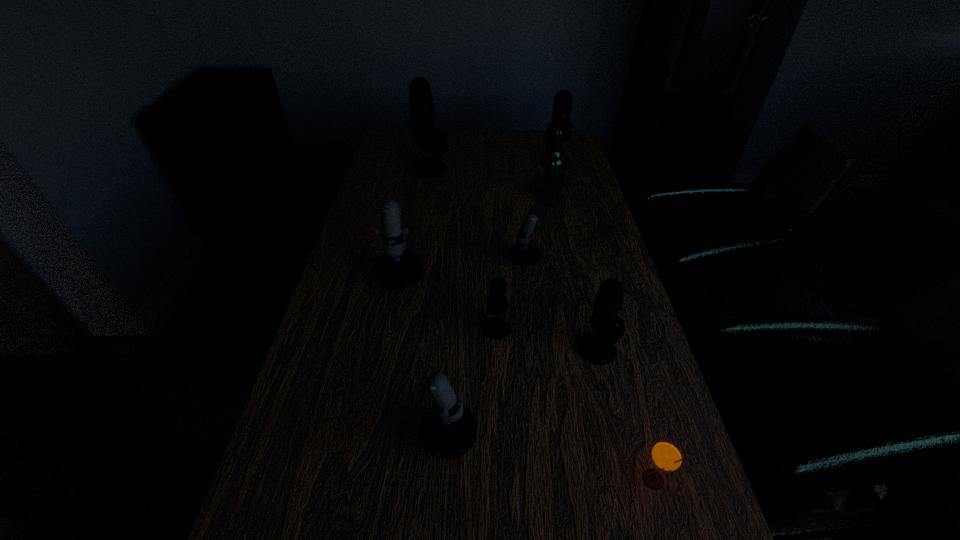
Locate an element on the screen. The width and height of the screenshot is (960, 540). free space located on the front of the second black microphone from left to right is located at coordinates (498, 385).

This screenshot has width=960, height=540. What are the coordinates of `free spot located on the back of the straw` in the screenshot? It's located at (624, 375).

In order to click on object situated at the far edge in this screenshot , I will do `click(562, 107)`.

Identify the location of beer bottle located in the right edge section of the desktop. (554, 163).

Locate an element on the screen. straw positioned at the right edge is located at coordinates (667, 455).

Locate an element on the screen. The height and width of the screenshot is (540, 960). object that is at the far right corner is located at coordinates (562, 107).

You are a GUI agent. You are given a task and a screenshot of the screen. Output one action in this format:
    pyautogui.click(x=<x>, y=<y>)
    Task: Click on the vacant space at the far edge of the desktop
    The height and width of the screenshot is (540, 960).
    Given the screenshot: What is the action you would take?
    pyautogui.click(x=487, y=137)

In the image, there is a desktop. Find the location of `vacant space at the left edge`. vacant space at the left edge is located at coordinates (387, 323).

You are a GUI agent. You are given a task and a screenshot of the screen. Output one action in this format:
    pyautogui.click(x=<x>, y=<y>)
    Task: Click on the blank space at the right edge of the desktop
    The height and width of the screenshot is (540, 960).
    Given the screenshot: What is the action you would take?
    pyautogui.click(x=556, y=244)

Image resolution: width=960 pixels, height=540 pixels. In the image, there is a desktop. Find the location of `vacant region at the far right corner`. vacant region at the far right corner is located at coordinates (576, 158).